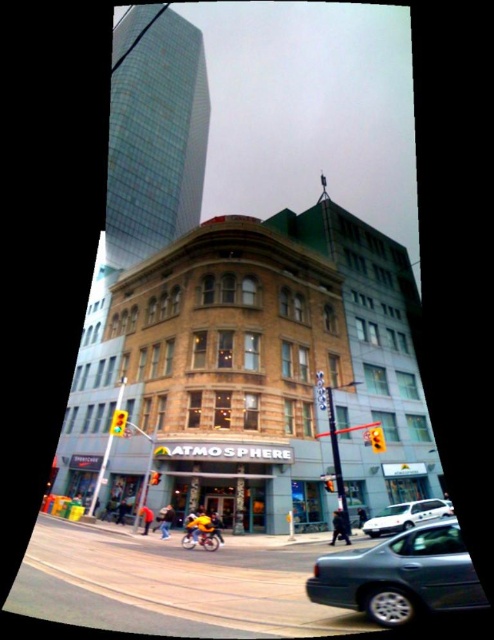
Between metallic silver car at lower right and metallic gray sedan at lower right, which one appears on the right side from the viewer's perspective?

metallic gray sedan at lower right

How far apart are metallic silver car at lower right and metallic gray sedan at lower right?

metallic silver car at lower right and metallic gray sedan at lower right are 7.38 meters apart from each other.

The width and height of the screenshot is (494, 640). I want to click on metallic silver car at lower right, so click(x=194, y=577).

What do you see at coordinates (401, 577) in the screenshot? The width and height of the screenshot is (494, 640). I see `metallic gray sedan at lower right` at bounding box center [401, 577].

Is metallic gray sedan at lower right wider than white matte car at lower right?

Yes.

Describe the element at coordinates (401, 577) in the screenshot. I see `metallic gray sedan at lower right` at that location.

I want to click on metallic gray sedan at lower right, so click(x=401, y=577).

Does metallic silver car at lower right have a smaller size compared to white matte car at lower right?

No, metallic silver car at lower right is not smaller than white matte car at lower right.

Is metallic silver car at lower right bigger than white matte car at lower right?

Yes, metallic silver car at lower right is bigger than white matte car at lower right.

Is point (156, 580) farther from camera compared to point (411, 518)?

No.

In order to click on metallic silver car at lower right in this screenshot , I will do `click(194, 577)`.